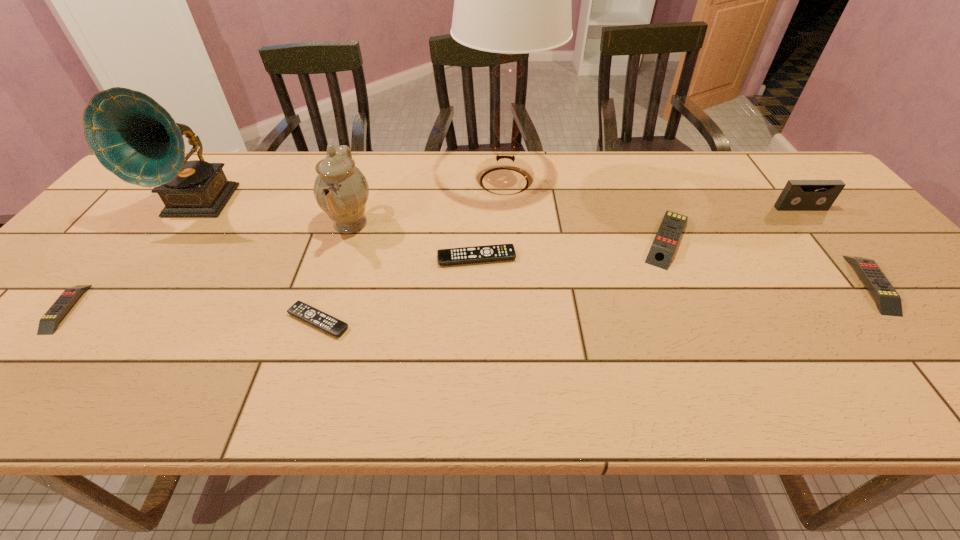
At what (x,y) coordinates should I click in order to perform the action: click on free space between the eighth shortest object and the videotape. Please return your answer as a coordinate pair (x, y). The image size is (960, 540). Looking at the image, I should click on (500, 206).

Locate an element on the screen. free space between the tallest object and the leftmost yellow remote control is located at coordinates (285, 245).

You are a GUI agent. You are given a task and a screenshot of the screen. Output one action in this format:
    pyautogui.click(x=<x>, y=<y>)
    Task: Click on the free space between the rightmost remote control and the shortest remote control
    The width and height of the screenshot is (960, 540).
    Given the screenshot: What is the action you would take?
    pyautogui.click(x=594, y=302)

In order to click on empty space that is in between the chinaware and the tallest remote control in this screenshot , I will do `click(509, 231)`.

Locate which object ranks fifth in proximity to the third remote control from left to right. Please provide its 2D coordinates. Your answer should be formatted as a tuple, i.e. [(x, y)], where the tuple contains the x and y coordinates of a point satisfying the conditions above.

[(135, 138)]

This screenshot has height=540, width=960. I want to click on the fifth closest object to the third object from right to left, so click(341, 190).

Identify which remote control is located as the fourth nearest to the shortest object. Please provide its 2D coordinates. Your answer should be formatted as a tuple, i.e. [(x, y)], where the tuple contains the x and y coordinates of a point satisfying the conditions above.

[(888, 301)]

Locate which remote control is the closest to the leftmost yellow remote control. Please provide its 2D coordinates. Your answer should be formatted as a tuple, i.e. [(x, y)], where the tuple contains the x and y coordinates of a point satisfying the conditions above.

[(303, 311)]

This screenshot has height=540, width=960. Identify the location of yellow remote control object that ranks as the closest to the fourth shortest object. (667, 237).

Where is `yellow remote control that is the closest one to the bigger black remote control`? This screenshot has height=540, width=960. yellow remote control that is the closest one to the bigger black remote control is located at coordinates (667, 237).